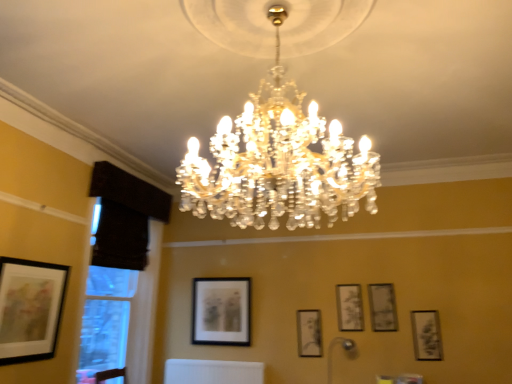
Question: From the image's perspective, would you say matte black picture frame at lower left, which is the 6th picture frame in back-to-front order, is positioned over clear crystal chandelier at center, positioned as the 1th lamp in front-to-back order?

Choices:
 (A) no
 (B) yes

Answer: (A)

Question: Does matte black picture frame at lower left, which is the sixth picture frame from right to left, have a greater height compared to clear crystal chandelier at center, which is counted as the second lamp, starting from the right?

Choices:
 (A) no
 (B) yes

Answer: (A)

Question: Is matte black picture frame at lower left, which is the 6th picture frame in back-to-front order, to the left of clear crystal chandelier at center, the second lamp in the bottom-to-top sequence, from the viewer's perspective?

Choices:
 (A) yes
 (B) no

Answer: (A)

Question: Is matte black picture frame at lower left, arranged as the 1th picture frame when viewed from the left, further to camera compared to clear crystal chandelier at center, the first lamp in the top-to-bottom sequence?

Choices:
 (A) no
 (B) yes

Answer: (B)

Question: Is matte black picture frame at lower left, which is the 6th picture frame in back-to-front order, not near clear crystal chandelier at center, the second lamp in the bottom-to-top sequence?

Choices:
 (A) no
 (B) yes

Answer: (B)

Question: Is the position of matte black picture frame at lower left, the 1th picture frame positioned from the front, less distant than that of clear crystal chandelier at center, the 2th lamp from the back?

Choices:
 (A) yes
 (B) no

Answer: (B)

Question: Is matte black picture frame at upper right, arranged as the 6th picture frame when viewed from the left, bigger than clear crystal chandelier at center, which ranks as the 1th lamp in left-to-right order?

Choices:
 (A) no
 (B) yes

Answer: (A)

Question: From a real-world perspective, is matte black picture frame at upper right, arranged as the 6th picture frame when viewed from the left, physically above clear crystal chandelier at center, which ranks as the 1th lamp in left-to-right order?

Choices:
 (A) yes
 (B) no

Answer: (B)

Question: From the image's perspective, does matte black picture frame at upper right, arranged as the 6th picture frame when viewed from the left, appear lower than clear crystal chandelier at center, which is counted as the second lamp, starting from the right?

Choices:
 (A) yes
 (B) no

Answer: (A)

Question: Is matte black picture frame at upper right, which is counted as the 1th picture frame, starting from the right, positioned behind clear crystal chandelier at center, the first lamp in the top-to-bottom sequence?

Choices:
 (A) yes
 (B) no

Answer: (A)

Question: Considering the relative positions of matte black picture frame at upper right, marked as the 2th picture frame in a front-to-back arrangement, and clear crystal chandelier at center, positioned as the 1th lamp in front-to-back order, in the image provided, is matte black picture frame at upper right, marked as the 2th picture frame in a front-to-back arrangement, to the right of clear crystal chandelier at center, positioned as the 1th lamp in front-to-back order, from the viewer's perspective?

Choices:
 (A) yes
 (B) no

Answer: (A)

Question: Considering the relative sizes of matte black picture frame at upper right, marked as the 2th picture frame in a front-to-back arrangement, and clear crystal chandelier at center, the 2th lamp from the back, in the image provided, is matte black picture frame at upper right, marked as the 2th picture frame in a front-to-back arrangement, shorter than clear crystal chandelier at center, the 2th lamp from the back,?

Choices:
 (A) no
 (B) yes

Answer: (B)

Question: Can you confirm if matte black picture frame at center, the fifth picture frame in the right-to-left sequence, is smaller than matte black picture frame at upper right, marked as the 2th picture frame in a front-to-back arrangement?

Choices:
 (A) yes
 (B) no

Answer: (B)